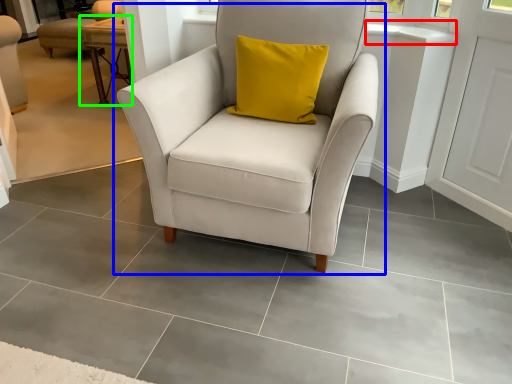
Question: Which object is positioned closest to window sill (highlighted by a red box)? Select from chair (highlighted by a blue box) and table (highlighted by a green box).

Choices:
 (A) chair
 (B) table

Answer: (A)